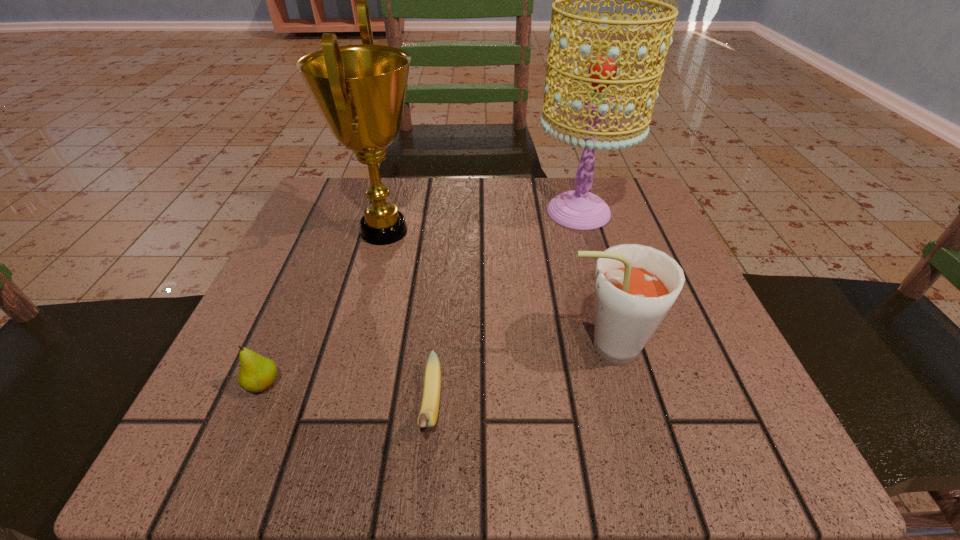
You are a GUI agent. You are given a task and a screenshot of the screen. Output one action in this format:
    pyautogui.click(x=<x>, y=<y>)
    Task: Click on the lampshade
    Image resolution: width=960 pixels, height=540 pixels.
    Given the screenshot: What is the action you would take?
    pyautogui.click(x=579, y=209)

The height and width of the screenshot is (540, 960). Identify the location of award. tap(360, 90).

Locate an element on the screen. The width and height of the screenshot is (960, 540). the third shortest object is located at coordinates (635, 286).

Locate an element on the screen. The height and width of the screenshot is (540, 960). the second shortest object is located at coordinates (257, 373).

You are a GUI agent. You are given a task and a screenshot of the screen. Output one action in this format:
    pyautogui.click(x=<x>, y=<y>)
    Task: Click on the leftmost object
    
    Given the screenshot: What is the action you would take?
    pyautogui.click(x=257, y=373)

I want to click on the shortest object, so click(x=428, y=415).

Locate an element on the screen. the third object from right to left is located at coordinates (428, 415).

I want to click on vacant region located 0.370m on the front of the lampshade, so click(636, 407).

Locate an element on the screen. The height and width of the screenshot is (540, 960). free spot located 0.150m on the front view with handles of the award is located at coordinates (501, 231).

Locate an element on the screen. vacant space located 0.100m on the drink side of the third shortest object is located at coordinates (492, 347).